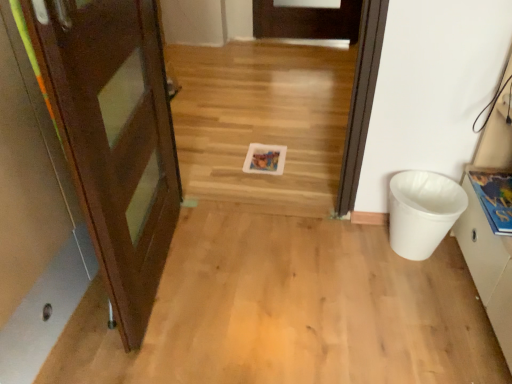
The image size is (512, 384). What do you see at coordinates (422, 211) in the screenshot?
I see `white plastic trash can at right` at bounding box center [422, 211].

This screenshot has height=384, width=512. In order to click on white matte cabinet at right in this screenshot , I will do `click(490, 229)`.

Is white plastic trash can at right bigger than white matte cabinet at right?

Incorrect, white plastic trash can at right is not larger than white matte cabinet at right.

From a real-world perspective, between white plastic trash can at right and white matte cabinet at right, who is vertically lower?

white plastic trash can at right is physically lower.

How far apart are white plastic trash can at right and white matte cabinet at right?

6.96 inches.

Who is shorter, white plastic trash can at right or white matte cabinet at right?

With less height is white plastic trash can at right.

Would you say white plastic trash can at right is part of white matte cabinet at right's contents?

No, white plastic trash can at right is not inside white matte cabinet at right.

From their relative heights in the image, would you say white matte cabinet at right is taller or shorter than white plastic trash can at right?

In the image, white matte cabinet at right appears to be taller than white plastic trash can at right.

Between white matte cabinet at right and white plastic trash can at right, which one has smaller size?

With smaller size is white plastic trash can at right.

Does white matte cabinet at right contain matte brown door at left?

No, matte brown door at left is located outside of white matte cabinet at right.

Who is taller, white matte cabinet at right or matte brown door at left?

matte brown door at left.

Is there a large distance between white matte cabinet at right and matte brown door at left?

Yes, white matte cabinet at right and matte brown door at left are located far from each other.

Is white matte cabinet at right wider or thinner than matte brown door at left?

In the image, white matte cabinet at right appears to be more narrow than matte brown door at left.

Does matte brown door at left turn towards white matte cabinet at right?

No, matte brown door at left is not facing towards white matte cabinet at right.

Can you confirm if matte brown door at left is wider than white matte cabinet at right?

Indeed, matte brown door at left has a greater width compared to white matte cabinet at right.

Are matte brown door at left and white matte cabinet at right located far from each other?

Yes.

Considering their positions, is white plastic trash can at right located in front of or behind matte brown door at left?

white plastic trash can at right is behind matte brown door at left.

Considering the sizes of white plastic trash can at right and matte brown door at left in the image, is white plastic trash can at right bigger or smaller than matte brown door at left?

In the image, white plastic trash can at right appears to be smaller than matte brown door at left.

Does white plastic trash can at right have a greater height compared to matte brown door at left?

No.

Could you tell me if white plastic trash can at right is facing matte brown door at left?

No, white plastic trash can at right does not turn towards matte brown door at left.

From a real-world perspective, is matte brown door at left above or below white plastic trash can at right?

From a real-world perspective, matte brown door at left is physically above white plastic trash can at right.

Does point (120, 0) lie behind point (397, 188)?

That is False.

From the image's perspective, is matte brown door at left below white plastic trash can at right?

Actually, matte brown door at left appears above white plastic trash can at right in the image.

In terms of width, does matte brown door at left look wider or thinner when compared to white plastic trash can at right?

In the image, matte brown door at left appears to be wider than white plastic trash can at right.

You are a GUI agent. You are given a task and a screenshot of the screen. Output one action in this format:
    pyautogui.click(x=<x>, y=<y>)
    Task: Click on the waste container that is below the white matte cabinet at right (from the image's perspective)
    
    Given the screenshot: What is the action you would take?
    click(422, 211)

What are the coordinates of `cabinetry on the right side of white plastic trash can at right` in the screenshot? It's located at (490, 229).

Based on their spatial positions, is white matte cabinet at right or white plastic trash can at right further from matte brown door at left?

Based on the image, white matte cabinet at right appears to be further to matte brown door at left.

Which object lies nearer to the anchor point white matte cabinet at right, matte brown door at left or white plastic trash can at right?

The object closer to white matte cabinet at right is white plastic trash can at right.

Based on their spatial positions, is matte brown door at left or white matte cabinet at right further from white plastic trash can at right?

The object further to white plastic trash can at right is matte brown door at left.

Based on their spatial positions, is white plastic trash can at right or matte brown door at left closer to white matte cabinet at right?

The object closer to white matte cabinet at right is white plastic trash can at right.

Which object lies further to the anchor point matte brown door at left, white plastic trash can at right or white matte cabinet at right?

Among the two, white matte cabinet at right is located further to matte brown door at left.

When comparing their distances from white plastic trash can at right, does white matte cabinet at right or matte brown door at left seem closer?

white matte cabinet at right lies closer to white plastic trash can at right than the other object.

This screenshot has height=384, width=512. Identify the location of waste container situated between matte brown door at left and white matte cabinet at right from left to right. (422, 211).